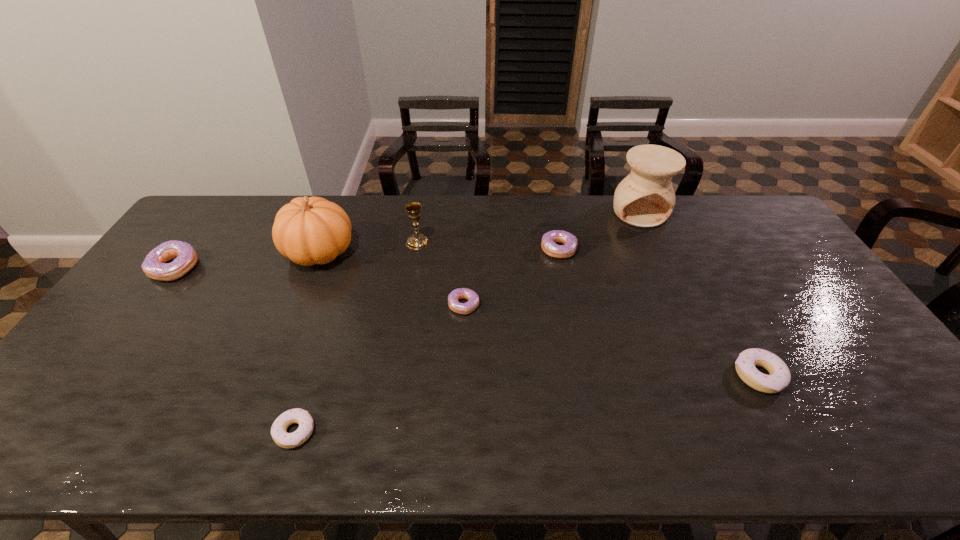
Find the location of a particular element. The height and width of the screenshot is (540, 960). free spot located 0.120m on the front of the rightmost doughnut is located at coordinates (796, 445).

The width and height of the screenshot is (960, 540). I want to click on vacant region located on the front of the smallest purple doughnut, so click(x=463, y=342).

The width and height of the screenshot is (960, 540). Identify the location of vacant space situated on the back of the second doughnut from left to right. (310, 383).

Locate an element on the screen. pottery that is at the far edge is located at coordinates (645, 198).

Find the location of a particular element. pumpkin that is positioned at the far edge is located at coordinates (309, 231).

Locate an element on the screen. Image resolution: width=960 pixels, height=540 pixels. chalice positioned at the far edge is located at coordinates (417, 241).

Where is `object at the near edge`? object at the near edge is located at coordinates (279, 433).

Locate an element on the screen. The height and width of the screenshot is (540, 960). object located at the left edge is located at coordinates (155, 266).

At what (x,y) coordinates should I click in order to perform the action: click on free location at the far edge. Please return your answer as a coordinate pair (x, y). The width and height of the screenshot is (960, 540). Looking at the image, I should click on (x=274, y=213).

You are a GUI agent. You are given a task and a screenshot of the screen. Output one action in this format:
    pyautogui.click(x=<x>, y=<y>)
    Task: Click on the vacant space at the near edge of the desktop
    
    Given the screenshot: What is the action you would take?
    pyautogui.click(x=248, y=450)